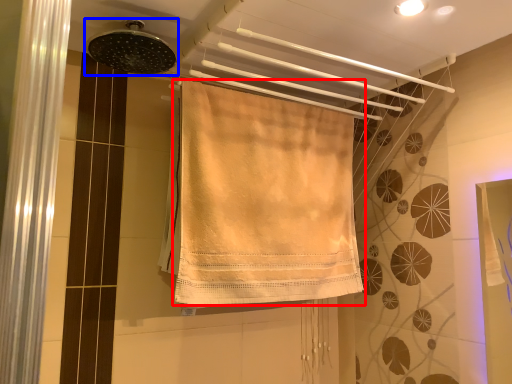
Question: Which object appears closest to the camera in this image, towel (highlighted by a red box) or shower (highlighted by a blue box)?

Choices:
 (A) towel
 (B) shower

Answer: (B)